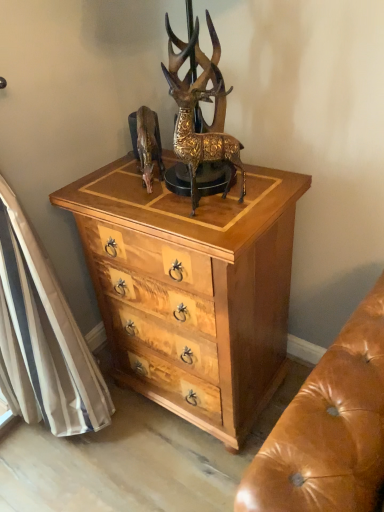
The height and width of the screenshot is (512, 384). Identify the location of gold textured deer at center. (200, 110).

Find the location of `light wood/texture chest of drawers at center`. light wood/texture chest of drawers at center is located at coordinates (192, 289).

The image size is (384, 512). What do you see at coordinates (148, 145) in the screenshot?
I see `shiny brown deer at center` at bounding box center [148, 145].

Locate an element on the screen. Image resolution: width=384 pixels, height=512 pixels. gold textured deer at center is located at coordinates (200, 110).

Which is behind, point (112, 295) or point (184, 130)?

Point (112, 295)

Is light wood/texture chest of drawers at center positioned far away from gold textured deer at center?

That's not correct — light wood/texture chest of drawers at center is a little close to gold textured deer at center.

Which object is wider, light wood/texture chest of drawers at center or gold textured deer at center?

Wider between the two is light wood/texture chest of drawers at center.

Locate an element on the screen. deer positioned vertically above the light wood/texture chest of drawers at center (from a real-world perspective) is located at coordinates (200, 110).

Is shiny brown deer at center positioned in front of gold textured deer at center?

A: No, the depth of shiny brown deer at center is greater than that of gold textured deer at center.

Can you tell me how much shiny brown deer at center and gold textured deer at center differ in facing direction?

The angular difference between shiny brown deer at center and gold textured deer at center is 20.7 degrees.

From the image's perspective, does shiny brown deer at center appear higher than gold textured deer at center?

Yes, from the image's perspective, shiny brown deer at center is over gold textured deer at center.

Is shiny brown deer at center turned away from gold textured deer at center?

shiny brown deer at center is not turned away from gold textured deer at center.

Who is smaller, light wood/texture chest of drawers at center or shiny brown deer at center?

Smaller between the two is shiny brown deer at center.

Which point is more forward, (252, 238) or (139, 137)?

The point (252, 238) is closer.

How distant is light wood/texture chest of drawers at center from shiny brown deer at center?

A distance of 16.84 inches exists between light wood/texture chest of drawers at center and shiny brown deer at center.

Identify the location of the chest of drawers that appears in front of the shiny brown deer at center. This screenshot has height=512, width=384. (192, 289).

This screenshot has height=512, width=384. I want to click on animal located underneath the gold textured deer at center (from a real-world perspective), so click(x=148, y=145).

From the image's perspective, is gold textured deer at center beneath shiny brown deer at center?

Yes, from the image's perspective, gold textured deer at center is beneath shiny brown deer at center.

Is gold textured deer at center aimed at shiny brown deer at center?

No, gold textured deer at center is not aimed at shiny brown deer at center.

Who is shorter, gold textured deer at center or shiny brown deer at center?

shiny brown deer at center.

Is point (192, 65) positioned after point (194, 240)?

That is True.

Are gold textured deer at center and light wood/texture chest of drawers at center located far from each other?

No.

Locate an element on the screen. This screenshot has height=512, width=384. the chest of drawers behind the gold textured deer at center is located at coordinates (192, 289).

Is shiny brown deer at center next to light wood/texture chest of drawers at center and touching it?

shiny brown deer at center is not next to light wood/texture chest of drawers at center, and they're not touching.

From the image's perspective, is shiny brown deer at center above or below light wood/texture chest of drawers at center?

Based on their image positions, shiny brown deer at center is located above light wood/texture chest of drawers at center.

Considering the relative positions of shiny brown deer at center and light wood/texture chest of drawers at center in the image provided, is shiny brown deer at center to the right of light wood/texture chest of drawers at center from the viewer's perspective?

No, shiny brown deer at center is not to the right of light wood/texture chest of drawers at center.

From a real-world perspective, who is located higher, shiny brown deer at center or light wood/texture chest of drawers at center?

shiny brown deer at center, from a real-world perspective.

Where is `deer on the right side of light wood/texture chest of drawers at center`? deer on the right side of light wood/texture chest of drawers at center is located at coordinates (200, 110).

You are a GUI agent. You are given a task and a screenshot of the screen. Output one action in this format:
    pyautogui.click(x=<x>, y=<y>)
    Task: Click on the animal directly beneath the gold textured deer at center (from a real-world perspective)
    This screenshot has height=512, width=384.
    Given the screenshot: What is the action you would take?
    pyautogui.click(x=148, y=145)

Considering their positions, is gold textured deer at center positioned closer to light wood/texture chest of drawers at center than shiny brown deer at center?

gold textured deer at center is positioned closer to the anchor light wood/texture chest of drawers at center.

Considering their positions, is light wood/texture chest of drawers at center positioned further to gold textured deer at center than shiny brown deer at center?

light wood/texture chest of drawers at center is further to gold textured deer at center.

Consider the image. When comparing their distances from shiny brown deer at center, does light wood/texture chest of drawers at center or gold textured deer at center seem closer?

Among the two, gold textured deer at center is located nearer to shiny brown deer at center.

Estimate the real-world distances between objects in this image. Which object is closer to light wood/texture chest of drawers at center, shiny brown deer at center or gold textured deer at center?

gold textured deer at center lies closer to light wood/texture chest of drawers at center than the other object.

When comparing their distances from shiny brown deer at center, does gold textured deer at center or light wood/texture chest of drawers at center seem closer?

Among the two, gold textured deer at center is located nearer to shiny brown deer at center.

When comparing their distances from gold textured deer at center, does shiny brown deer at center or light wood/texture chest of drawers at center seem further?

The object further to gold textured deer at center is light wood/texture chest of drawers at center.

Where is `deer between shiny brown deer at center and light wood/texture chest of drawers at center in the vertical direction`? This screenshot has width=384, height=512. deer between shiny brown deer at center and light wood/texture chest of drawers at center in the vertical direction is located at coordinates [x=200, y=110].